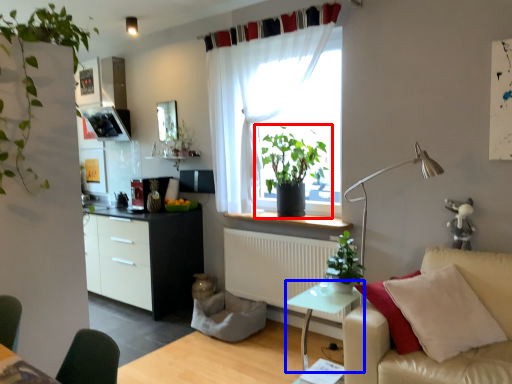
Question: Among these objects, which one is nearest to the camera, houseplant (highlighted by a red box) or table (highlighted by a blue box)?

Choices:
 (A) houseplant
 (B) table

Answer: (B)